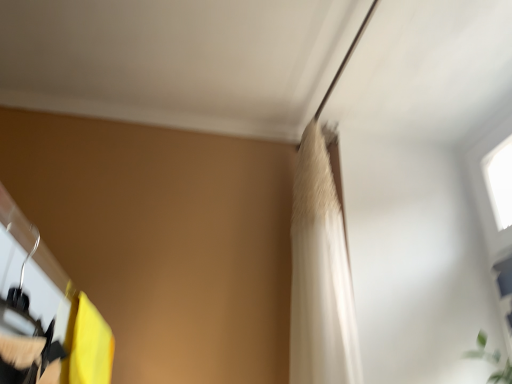
Question: From the image's perspective, is matte black hanger at left located beneath yellow fabric curtain at lower left?

Choices:
 (A) yes
 (B) no

Answer: (B)

Question: Considering the relative sizes of matte black hanger at left and yellow fabric curtain at lower left in the image provided, is matte black hanger at left thinner than yellow fabric curtain at lower left?

Choices:
 (A) yes
 (B) no

Answer: (A)

Question: Is matte black hanger at left far from yellow fabric curtain at lower left?

Choices:
 (A) yes
 (B) no

Answer: (B)

Question: Does matte black hanger at left have a lesser height compared to yellow fabric curtain at lower left?

Choices:
 (A) yes
 (B) no

Answer: (A)

Question: Does matte black hanger at left appear on the right side of yellow fabric curtain at lower left?

Choices:
 (A) yes
 (B) no

Answer: (A)

Question: Relative to white fabric shower curtain at upper center, is matte black hanger at left in front or behind?

Choices:
 (A) behind
 (B) front

Answer: (B)

Question: Looking at their shapes, would you say matte black hanger at left is wider or thinner than white fabric shower curtain at upper center?

Choices:
 (A) wide
 (B) thin

Answer: (A)

Question: In terms of size, does matte black hanger at left appear bigger or smaller than white fabric shower curtain at upper center?

Choices:
 (A) big
 (B) small

Answer: (B)

Question: In terms of height, does matte black hanger at left look taller or shorter compared to white fabric shower curtain at upper center?

Choices:
 (A) tall
 (B) short

Answer: (B)

Question: Considering the positions of point (88, 360) and point (314, 283), is point (88, 360) closer or farther from the camera than point (314, 283)?

Choices:
 (A) farther
 (B) closer

Answer: (B)

Question: Based on their sizes in the image, would you say yellow fabric curtain at lower left is bigger or smaller than white fabric shower curtain at upper center?

Choices:
 (A) big
 (B) small

Answer: (B)

Question: From the image's perspective, relative to white fabric shower curtain at upper center, is yellow fabric curtain at lower left above or below?

Choices:
 (A) below
 (B) above

Answer: (A)

Question: Would you say yellow fabric curtain at lower left is inside or outside white fabric shower curtain at upper center?

Choices:
 (A) inside
 (B) outside

Answer: (B)

Question: Considering the positions of matte black hanger at left and yellow fabric curtain at lower left in the image, is matte black hanger at left taller or shorter than yellow fabric curtain at lower left?

Choices:
 (A) tall
 (B) short

Answer: (B)

Question: Is matte black hanger at left bigger or smaller than yellow fabric curtain at lower left?

Choices:
 (A) small
 (B) big

Answer: (A)